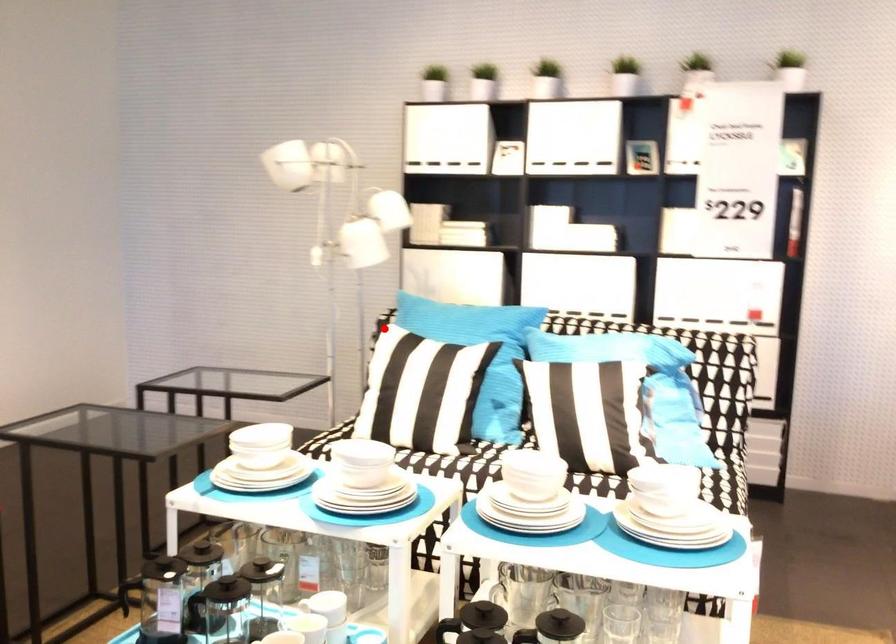
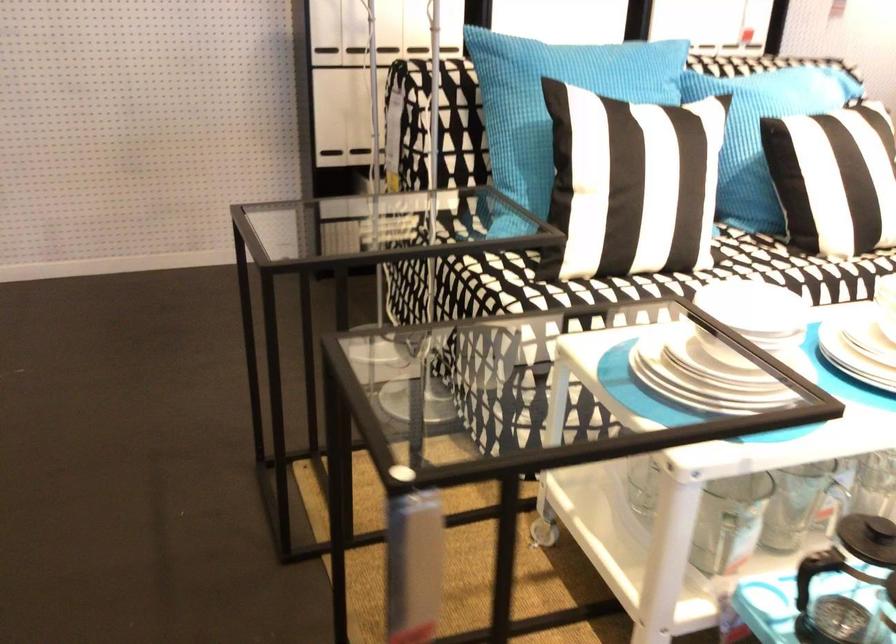
The point at the highlighted location is marked in the first image. Where is the corresponding point in the second image?

(554, 102)